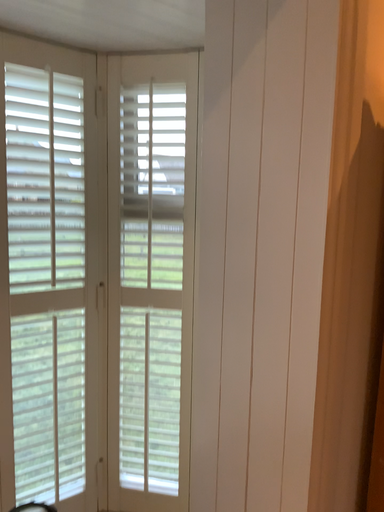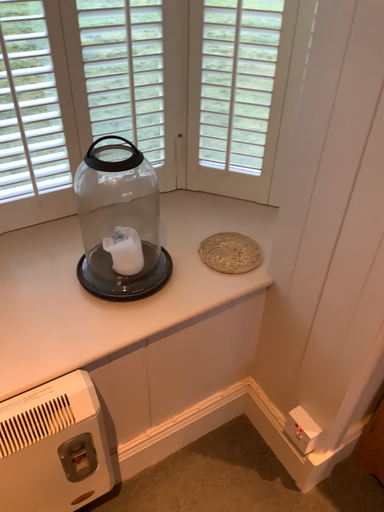
Question: How did the camera likely rotate when shooting the video?

Choices:
 (A) rotated left
 (B) rotated right

Answer: (A)